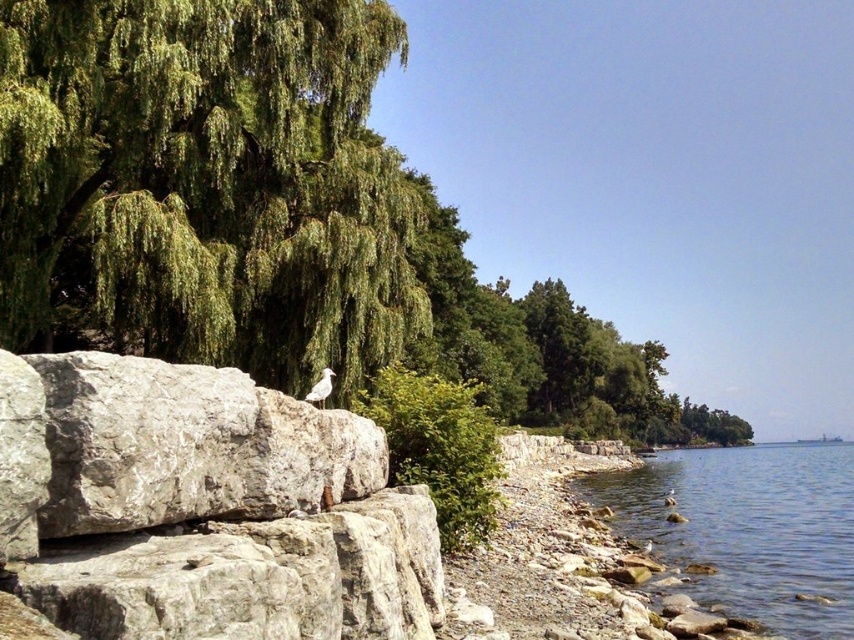
You are an artist planning to paint the lakeside scene. You want to ensure the green leafy tree at upper left and the green leafy tree at center are proportionally accurate. Which tree should you make smaller in your painting?

The green leafy tree at upper left should be painted smaller because it occupies less space than the green leafy tree at center.